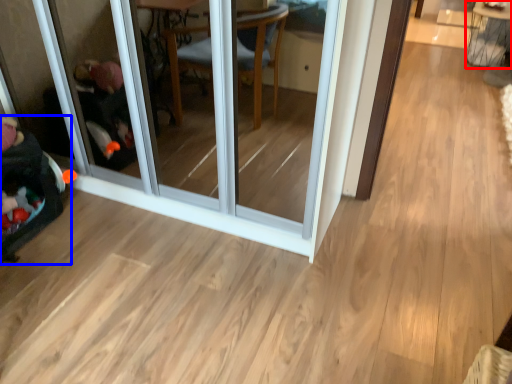
Question: Which object appears farthest to the camera in this image, table (highlighted by a red box) or baby carriage (highlighted by a blue box)?

Choices:
 (A) table
 (B) baby carriage

Answer: (A)